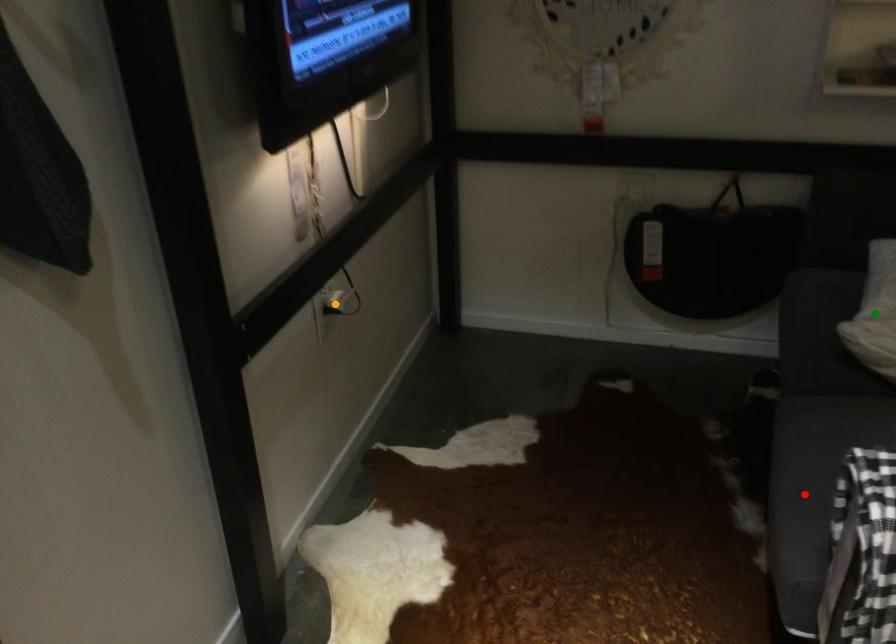
Order these from nearest to farthest:
1. orange point
2. green point
3. red point

1. red point
2. green point
3. orange point